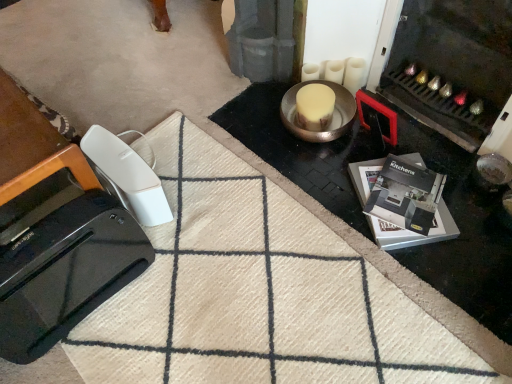
Question: Is black glossy toaster at lower left, acting as the 2th home appliance starting from the back, inside the boundaries of black glossy kitchens brochure at lower right, or outside?

Choices:
 (A) outside
 (B) inside

Answer: (A)

Question: Based on their positions, is black glossy toaster at lower left, the 1th home appliance from the front, located to the left or right of black glossy kitchens brochure at lower right?

Choices:
 (A) left
 (B) right

Answer: (A)

Question: Which is nearer to the beige woolen doormat at lower left?

Choices:
 (A) black glossy toaster at lower left, the 1th home appliance from the front
 (B) white plastic remote at lower left, marked as the second home appliance in a front-to-back arrangement
 (C) black glossy kitchens brochure at lower right

Answer: (A)

Question: Which object is positioned closest to the black glossy kitchens brochure at lower right?

Choices:
 (A) beige woolen doormat at lower left
 (B) white plastic remote at lower left, the 1th home appliance from the back
 (C) black glossy toaster at lower left, acting as the 2th home appliance starting from the back

Answer: (A)